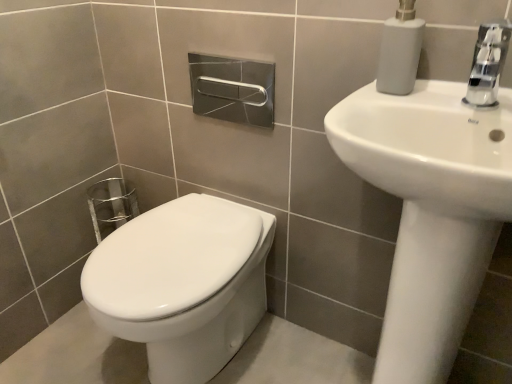
I want to click on free space above white glossy toilet at lower left (from a real-world perspective), so click(176, 234).